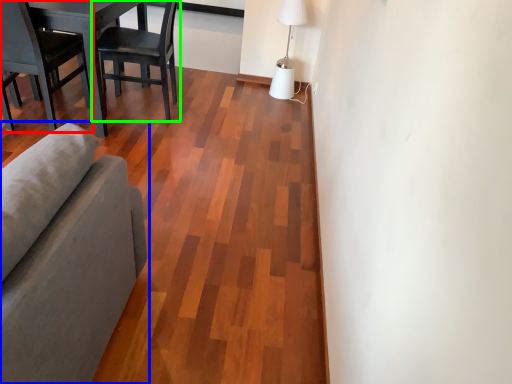
Question: Which is nearer to the chair (highlighted by a red box)? studio couch (highlighted by a blue box) or chair (highlighted by a green box).

Choices:
 (A) studio couch
 (B) chair

Answer: (B)